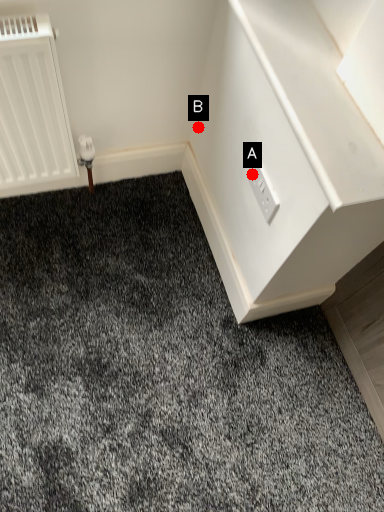
Question: Two points are circled on the image, labeled by A and B beside each circle. Which point is closer to the camera taking this photo?

Choices:
 (A) A is closer
 (B) B is closer

Answer: (A)